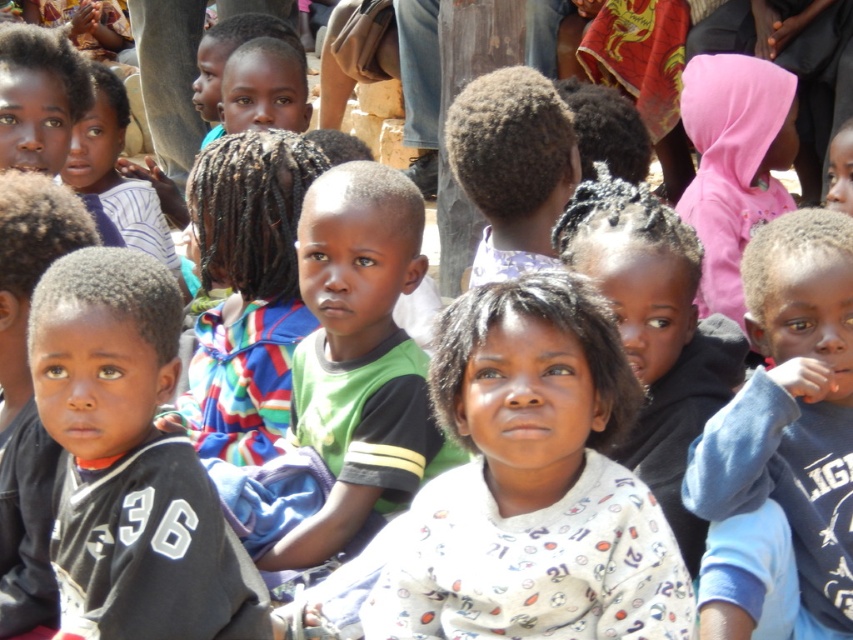
You are organizing a photo shoot and need to ensure that all clothing items are visible in the frame. Given that the blue fleece jacket at right and the green jersey at center are part of the composition, which clothing item might require adjustment to ensure it is fully visible?

The blue fleece jacket at right occupies less space than the green jersey at center, so it might require adjustment to ensure it is fully visible.

You are a photographer trying to capture a photo of the black jersey at left and the blue fleece jacket at right. If you want to ensure both items are fully visible in the frame, which one should you focus on first?

The black jersey at left is shorter than the blue fleece jacket at right, so you should focus on the blue fleece jacket at right first to ensure it is fully visible in the frame.

You are taking a photo of the scene and want to focus on the point at the lower part of the image. Which point, point at (123,298) or point at (366,276), is closer to the camera?

Point at (123,298) is closer to the camera than point at (366,276).